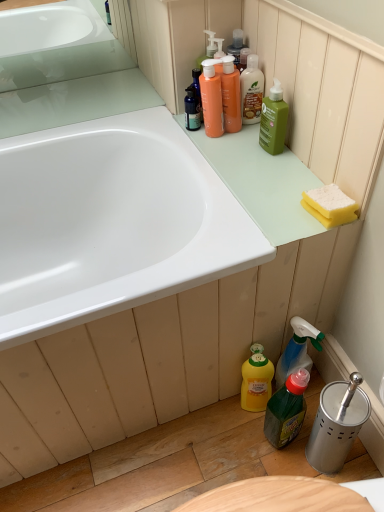
I want to click on vacant space behind yellow sponge at upper right, so click(x=278, y=170).